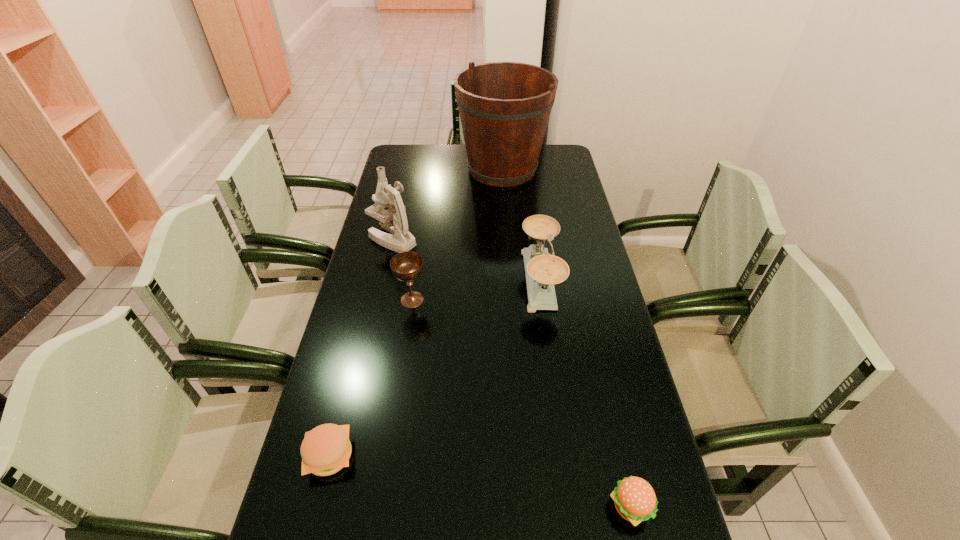
Locate an element on the screen. This screenshot has width=960, height=540. vacant point located between the nearest object and the third shortest object is located at coordinates (521, 403).

The height and width of the screenshot is (540, 960). I want to click on vacant space that's between the nearest object and the fifth shortest object, so click(512, 373).

Locate an element on the screen. This screenshot has height=540, width=960. free space between the chalice and the right hamburger is located at coordinates click(521, 403).

The width and height of the screenshot is (960, 540). I want to click on empty location between the chalice and the nearer hamburger, so click(521, 403).

Locate an element on the screen. This screenshot has width=960, height=540. vacant point located between the nearest object and the fifth farthest object is located at coordinates [480, 481].

You are a GUI agent. You are given a task and a screenshot of the screen. Output one action in this format:
    pyautogui.click(x=<x>, y=<y>)
    Task: Click on the free space between the farther hamburger and the third tallest object
    
    Given the screenshot: What is the action you would take?
    pyautogui.click(x=435, y=368)

Identify the location of vacant space in between the nearest object and the fourth shortest object. This screenshot has width=960, height=540. (585, 394).

Locate which object is the third closest to the second nearest object. Please provide its 2D coordinates. Your answer should be formatted as a tuple, i.e. [(x, y)], where the tuple contains the x and y coordinates of a point satisfying the conditions above.

[(635, 500)]

Choose which object is the second nearest neighbor to the fifth farthest object. Please provide its 2D coordinates. Your answer should be formatted as a tuple, i.e. [(x, y)], where the tuple contains the x and y coordinates of a point satisfying the conditions above.

[(543, 270)]

The height and width of the screenshot is (540, 960). Identify the location of vacant space that satisfies the following two spatial constraints: 1. on the front-facing side of the third tallest object; 2. on the back side of the nearest object. tap(572, 507).